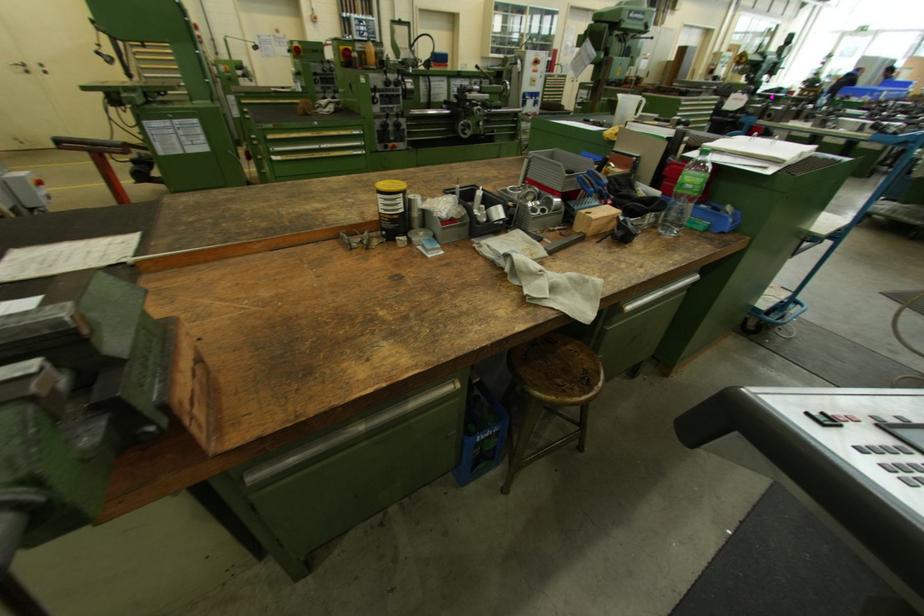
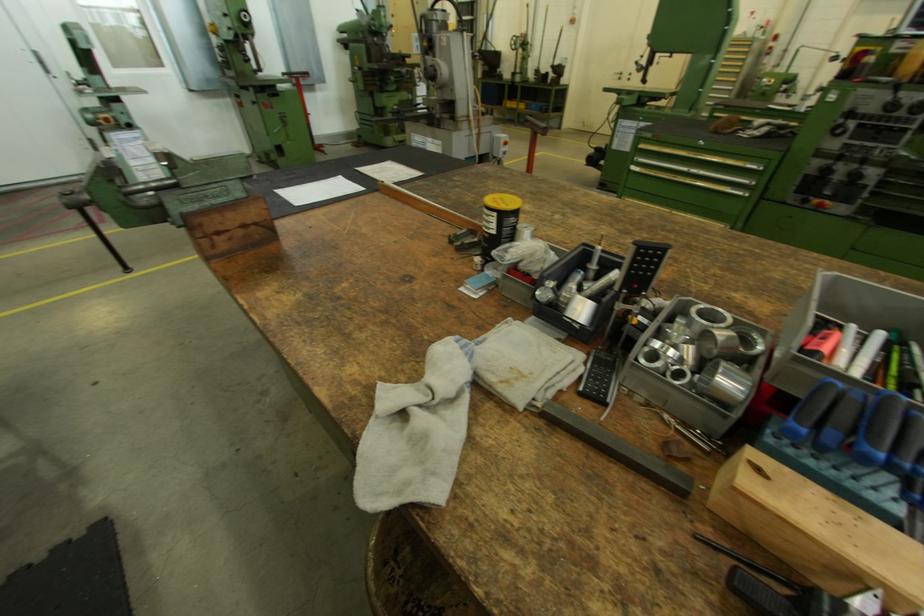
Where in the second image is the point corresponding to point 103,54 from the first image?

(642, 63)